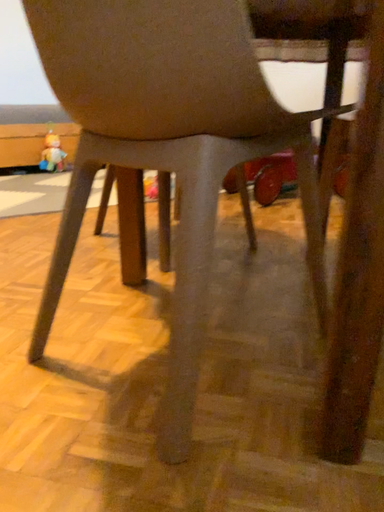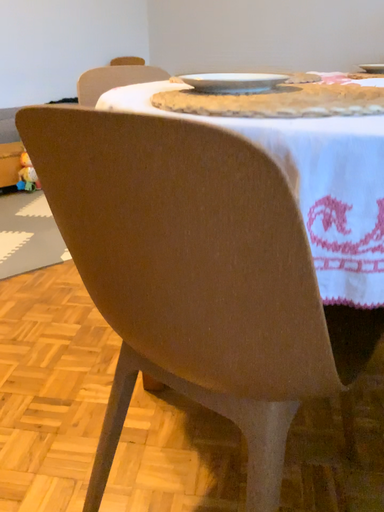
Question: Which way did the camera rotate in the video?

Choices:
 (A) rotated downward
 (B) rotated upward

Answer: (A)